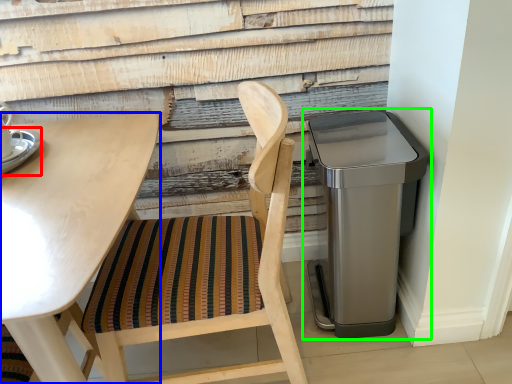
Question: Considering the real-world distances, which object is farthest from saucer (highlighted by a red box)? table (highlighted by a blue box) or waste container (highlighted by a green box)?

Choices:
 (A) table
 (B) waste container

Answer: (B)